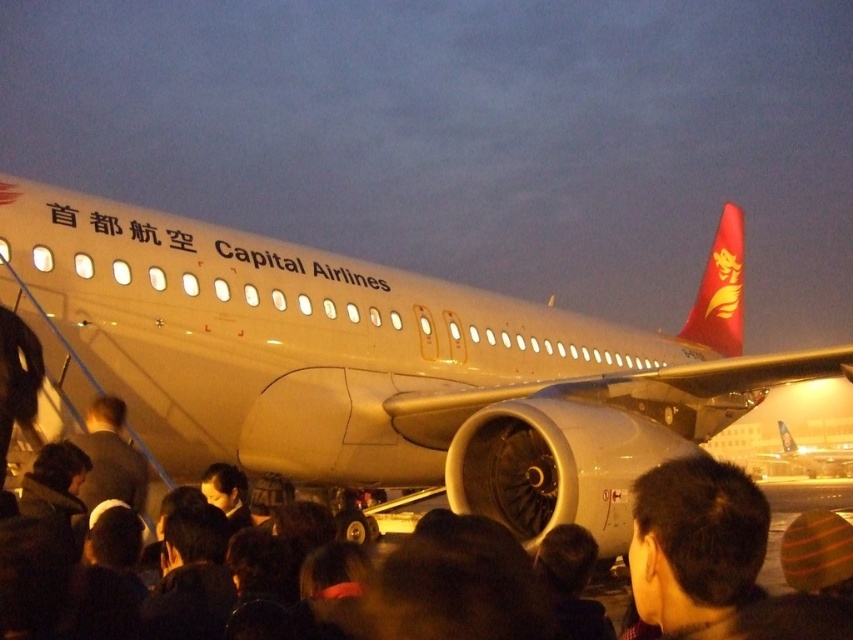
Does white matte airplane at center have a lesser height compared to matte white airplane at center?

No.

Can you confirm if white matte airplane at center is positioned to the left of matte white airplane at center?

Yes, white matte airplane at center is to the left of matte white airplane at center.

Is point (167, 241) in front of point (830, 468)?

Yes, it is in front of point (830, 468).

At what (x,y) coordinates should I click in order to perform the action: click on white matte airplane at center. Please return your answer as a coordinate pair (x, y). Image resolution: width=853 pixels, height=640 pixels. Looking at the image, I should click on (379, 364).

Does point (196, 268) lie behind point (788, 499)?

No, (196, 268) is in front of (788, 499).

Is white matte airplane at center to the left of black matte crowd at lower center from the viewer's perspective?

Yes, white matte airplane at center is to the left of black matte crowd at lower center.

Is point (227, 234) behind point (775, 484)?

No.

This screenshot has height=640, width=853. I want to click on white matte airplane at center, so click(379, 364).

Does point (837, 490) come closer to viewer compared to point (780, 429)?

That is True.

Who is more distant from viewer, (833,484) or (816,454)?

Positioned behind is point (816,454).

Describe the element at coordinates (793, 516) in the screenshot. I see `black matte crowd at lower center` at that location.

I want to click on black matte crowd at lower center, so click(793, 516).